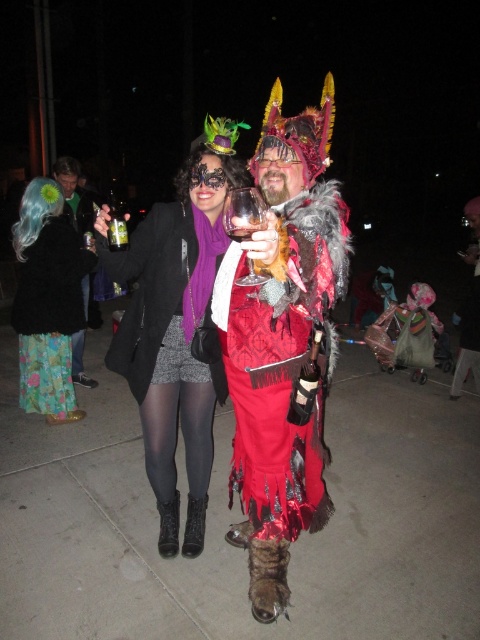
Question: In this image, where is matte black coat at center located relative to floral fabric dress at left?

Choices:
 (A) above
 (B) below

Answer: (A)

Question: Does floral fabric skirt at lower left appear on the right side of clear plastic cup at upper left?

Choices:
 (A) yes
 (B) no

Answer: (A)

Question: Which point is closer to the camera?

Choices:
 (A) floral fabric skirt at lower left
 (B) purple velvet scarf at center
 (C) shiny red fabric at center

Answer: (C)

Question: Is smooth concrete pavement at center in front of clear plastic cup at upper left?

Choices:
 (A) no
 (B) yes

Answer: (B)

Question: Based on their relative distances, which object is nearer to the floral fabric skirt at lower left?

Choices:
 (A) purple velvet scarf at center
 (B) smooth concrete pavement at center

Answer: (A)

Question: Which of the following is the closest to the observer?

Choices:
 (A) clear plastic cup at upper left
 (B) matte black coat at center
 (C) floral fabric skirt at lower left

Answer: (B)